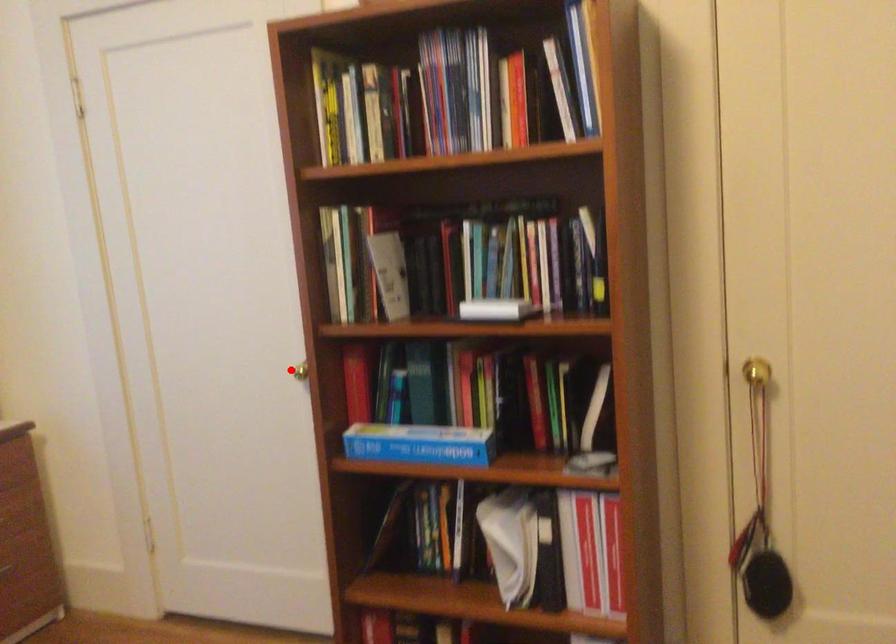
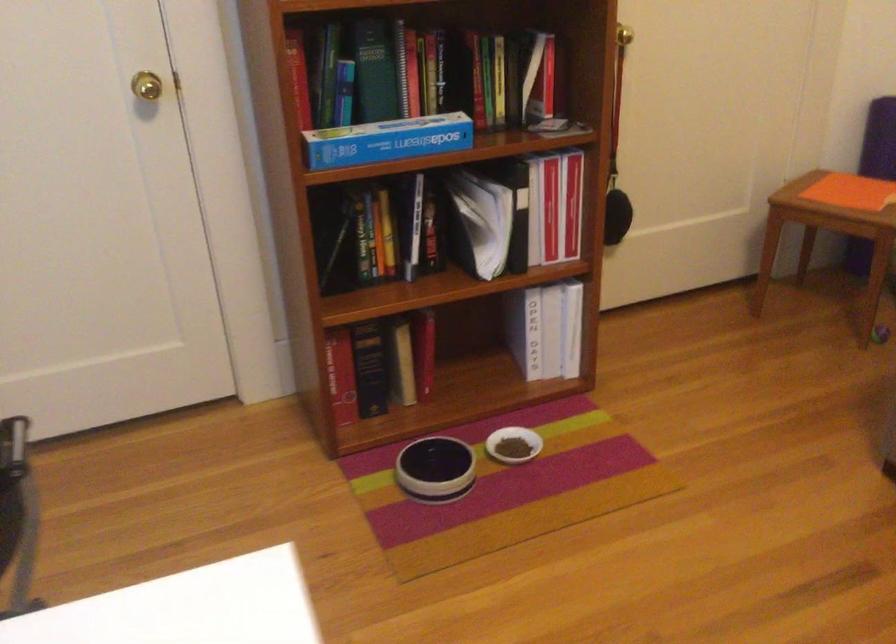
Question: I am providing you with two images of the same scene from different viewpoints. In image1, a red point is highlighted. Considering the same 3D point in image2, which of the following is correct?

Choices:
 (A) It is closer
 (B) It is farther

Answer: (A)